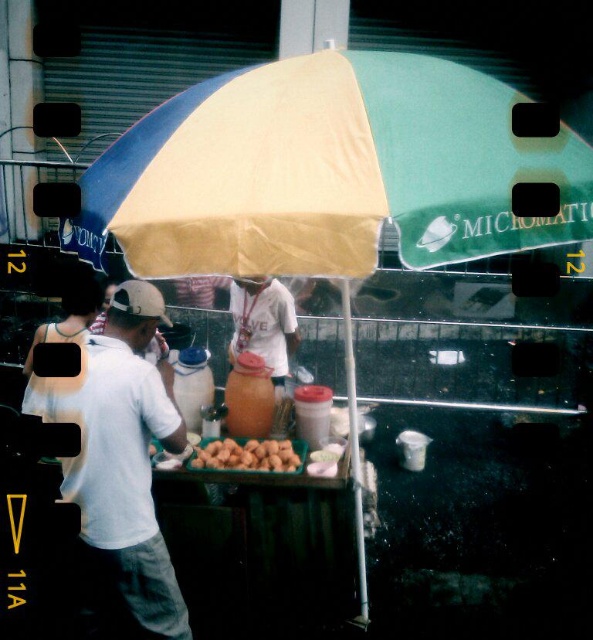
Question: Among these points, which one is farthest from the camera?

Choices:
 (A) (199, 465)
 (B) (272, 285)

Answer: (B)

Question: Does white jersey at center have a lesser width compared to brown matte nuts at center?

Choices:
 (A) yes
 (B) no

Answer: (A)

Question: Which of the following is the farthest from the observer?

Choices:
 (A) white matte shirt at center
 (B) brown matte nuts at center

Answer: (B)

Question: Does white matte shirt at center have a smaller size compared to white jersey at center?

Choices:
 (A) no
 (B) yes

Answer: (A)

Question: Among these points, which one is farthest from the camera?

Choices:
 (A) (85, 513)
 (B) (221, 460)

Answer: (B)

Question: Is white matte shirt at center positioned before brown matte nuts at center?

Choices:
 (A) no
 (B) yes

Answer: (B)